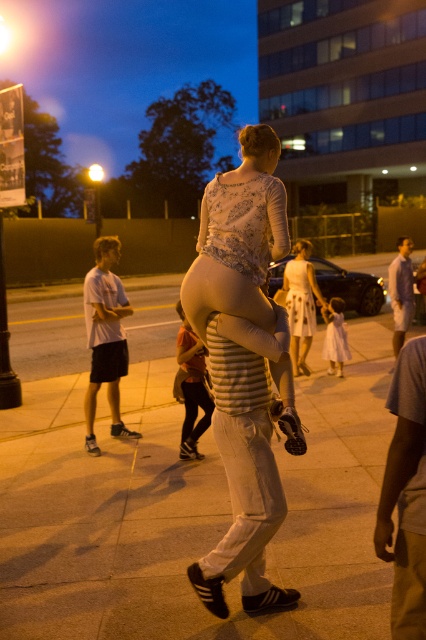
Question: Which object is closer to the camera taking this photo?

Choices:
 (A) sandy concrete sidewalk at center
 (B) white satin dress at center

Answer: (A)

Question: Which object is positioned closest to the light beige fabric at center?

Choices:
 (A) white lace dress at center
 (B) sandy concrete sidewalk at center

Answer: (B)

Question: Among these objects, which one is farthest from the camera?

Choices:
 (A) sandy concrete sidewalk at center
 (B) white striped shirt at center
 (C) white cotton t-shirt at left

Answer: (C)

Question: Does light beige fabric at center have a smaller size compared to white satin dress at center?

Choices:
 (A) no
 (B) yes

Answer: (A)

Question: Does light purple striped shirt at center have a larger size compared to white cotton dress at center?

Choices:
 (A) yes
 (B) no

Answer: (A)

Question: Is sandy concrete sidewalk at center above white cotton dress at center?

Choices:
 (A) no
 (B) yes

Answer: (A)